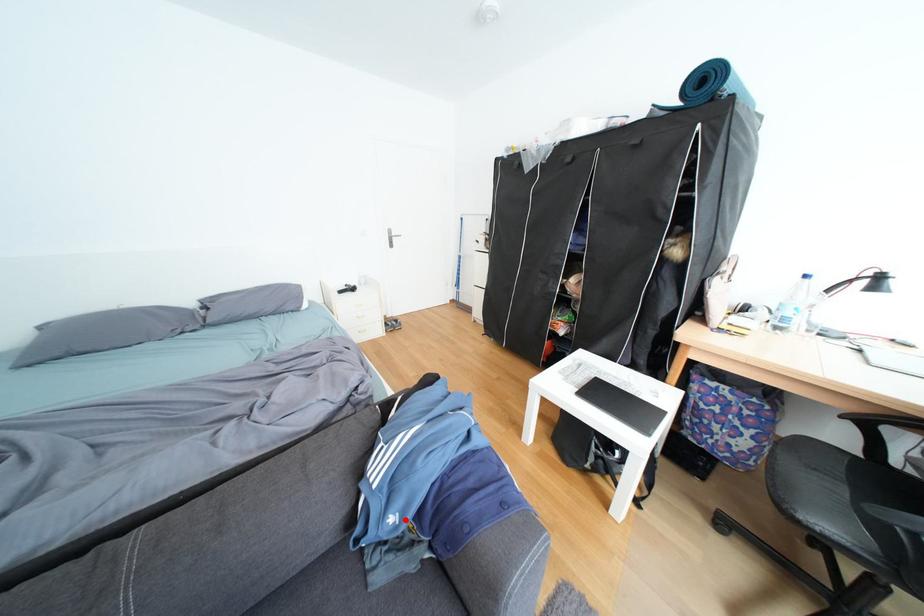
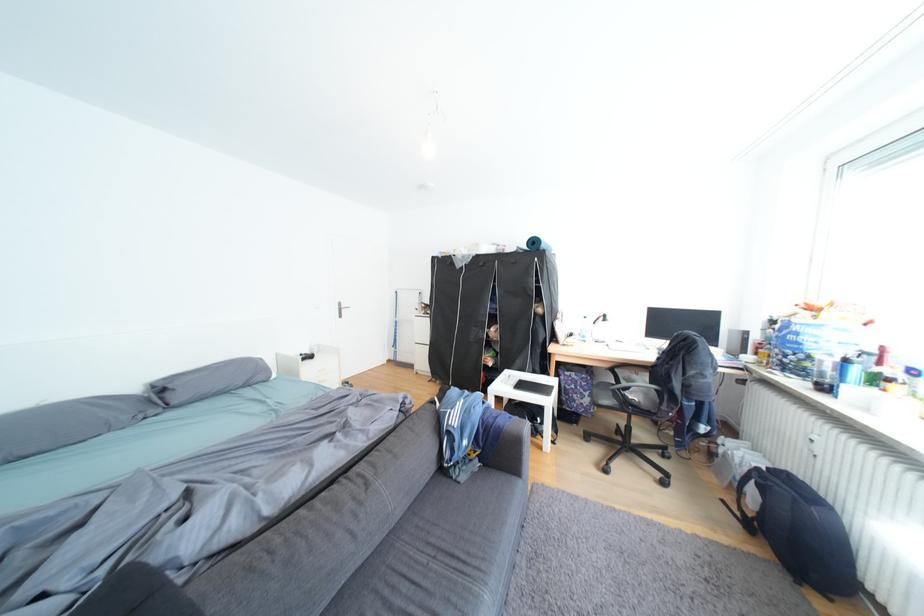
The point at the highlighted location is marked in the first image. Where is the corresponding point in the second image?

(478, 444)